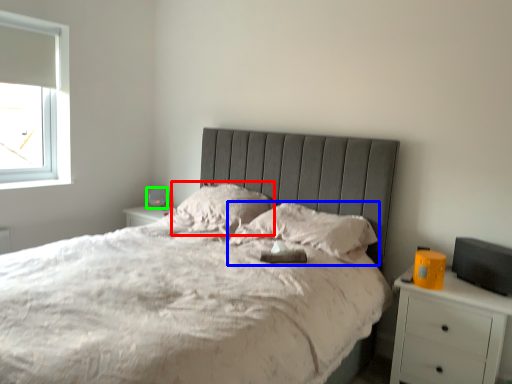
Question: Estimate the real-world distances between objects in this image. Which object is farther from pillow (highlighted by a red box), pillow (highlighted by a blue box) or table lamp (highlighted by a green box)?

Choices:
 (A) pillow
 (B) table lamp

Answer: (B)